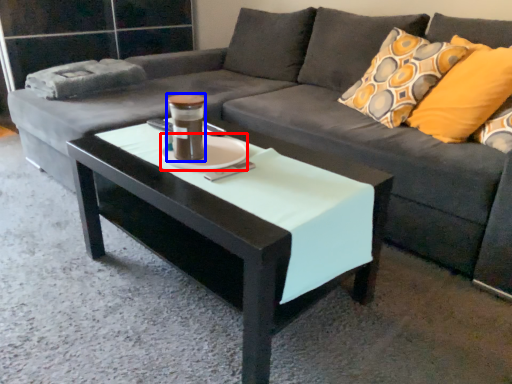
Question: Which object is closer to the camera taking this photo, saucer (highlighted by a red box) or beverage (highlighted by a blue box)?

Choices:
 (A) saucer
 (B) beverage

Answer: (B)